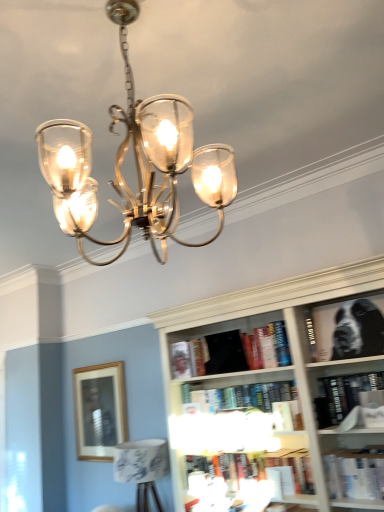
Find the location of a particular element. Image resolution: width=384 pixels, height=512 pixels. empty space that is ontop of polished brass chandelier at upper center (from a real-world perspective) is located at coordinates (x=123, y=27).